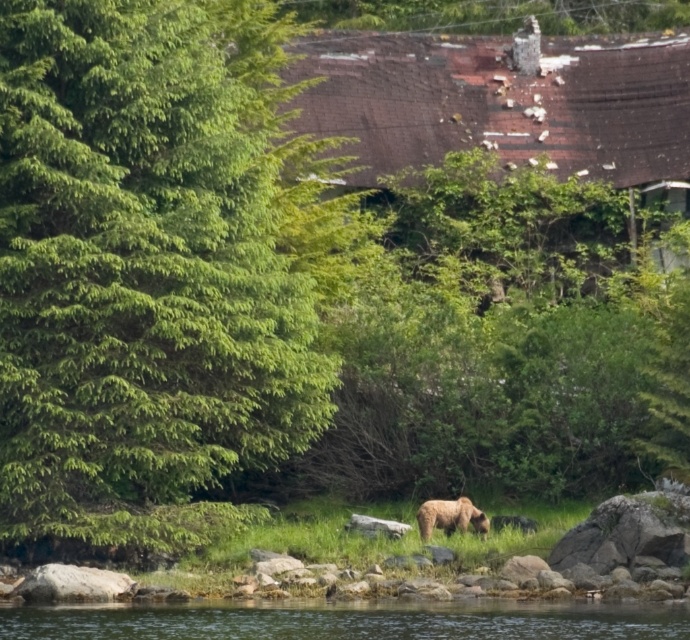
You are a hiker who wants to cross the clear water at lower center to reach the green leafy tree at center. Is the tree on the same side as the water or the opposite side?

The green leafy tree at center is positioned on the left side of clear water at lower center, so the tree is on the same side as the water.

In the scene with a bear and a dilapidated building, there is a green leafy tree at center and a point marked at coordinates (157, 266). Can you tell me if the point is located on the green leafy tree at center?

The point at coordinates (157, 266) represents the green leafy tree at center, so yes, the point is located on the green leafy tree at center.

You are standing in the natural scene described. You want to take a photo of the green leafy tree at center without including the dilapidated building in the background. Based on its position, is the tree positioned in a way that allows you to frame it without the building?

The green leafy tree at center is located at point (157,266), which suggests it is positioned in the foreground. Since the dilapidated building is in the background, you can frame the tree without including the building by focusing on its central position while ensuring the background is out of the shot.